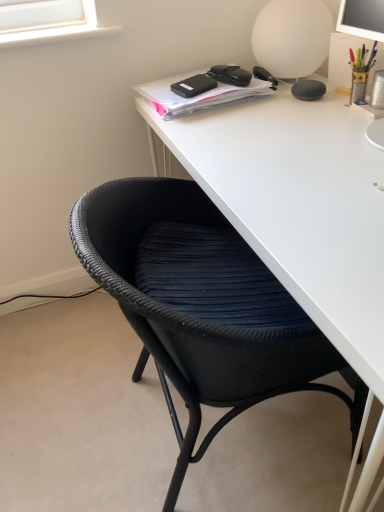
Question: Is black matte notebook at upper center to the left of white matte table lamp at upper right from the viewer's perspective?

Choices:
 (A) yes
 (B) no

Answer: (A)

Question: Could white matte table lamp at upper right be considered to be inside black matte notebook at upper center?

Choices:
 (A) yes
 (B) no

Answer: (B)

Question: Considering the relative sizes of black matte notebook at upper center and white matte table lamp at upper right in the image provided, is black matte notebook at upper center thinner than white matte table lamp at upper right?

Choices:
 (A) no
 (B) yes

Answer: (A)

Question: Can you confirm if black matte notebook at upper center is taller than white matte table lamp at upper right?

Choices:
 (A) yes
 (B) no

Answer: (B)

Question: Is black matte notebook at upper center oriented towards white matte table lamp at upper right?

Choices:
 (A) yes
 (B) no

Answer: (B)

Question: From their relative heights in the image, would you say matte black speaker at upper right, placed as the 3th stationery when sorted from left to right, is taller or shorter than black woven chair at lower left?

Choices:
 (A) tall
 (B) short

Answer: (B)

Question: Is matte black speaker at upper right, which is the second stationery from right to left, to the left or to the right of black woven chair at lower left in the image?

Choices:
 (A) left
 (B) right

Answer: (B)

Question: From the image's perspective, is matte black speaker at upper right, placed as the 3th stationery when sorted from left to right, positioned above or below black woven chair at lower left?

Choices:
 (A) below
 (B) above

Answer: (B)

Question: Does point (291, 91) appear closer or farther from the camera than point (274, 329)?

Choices:
 (A) farther
 (B) closer

Answer: (A)

Question: Does point (183, 88) appear closer or farther from the camera than point (329, 18)?

Choices:
 (A) farther
 (B) closer

Answer: (B)

Question: Is black matte hard drive at upper center, the 4th stationery in the right-to-left sequence, taller or shorter than white matte table lamp at upper right?

Choices:
 (A) short
 (B) tall

Answer: (A)

Question: Is black matte hard drive at upper center, the 4th stationery in the right-to-left sequence, wider or thinner than white matte table lamp at upper right?

Choices:
 (A) wide
 (B) thin

Answer: (B)

Question: From the image's perspective, is black matte hard drive at upper center, placed as the first stationery when sorted from left to right, positioned above or below white matte table lamp at upper right?

Choices:
 (A) below
 (B) above

Answer: (A)

Question: Is white matte table lamp at upper right taller or shorter than black matte glasses at upper center, acting as the third stationery starting from the right?

Choices:
 (A) tall
 (B) short

Answer: (A)

Question: In the image, is white matte table lamp at upper right positioned in front of or behind black matte glasses at upper center, acting as the third stationery starting from the right?

Choices:
 (A) front
 (B) behind

Answer: (A)